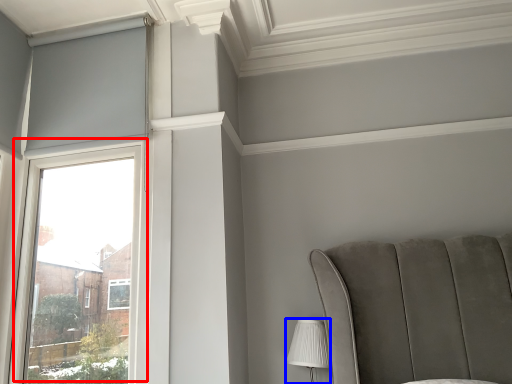
Question: Which point is further to the camera, window (highlighted by a red box) or table lamp (highlighted by a blue box)?

Choices:
 (A) window
 (B) table lamp

Answer: (B)